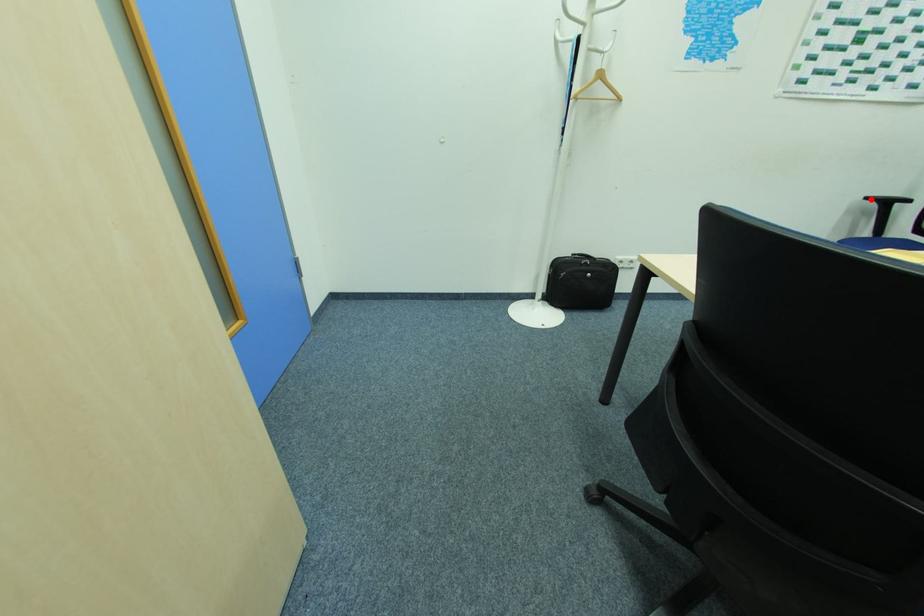
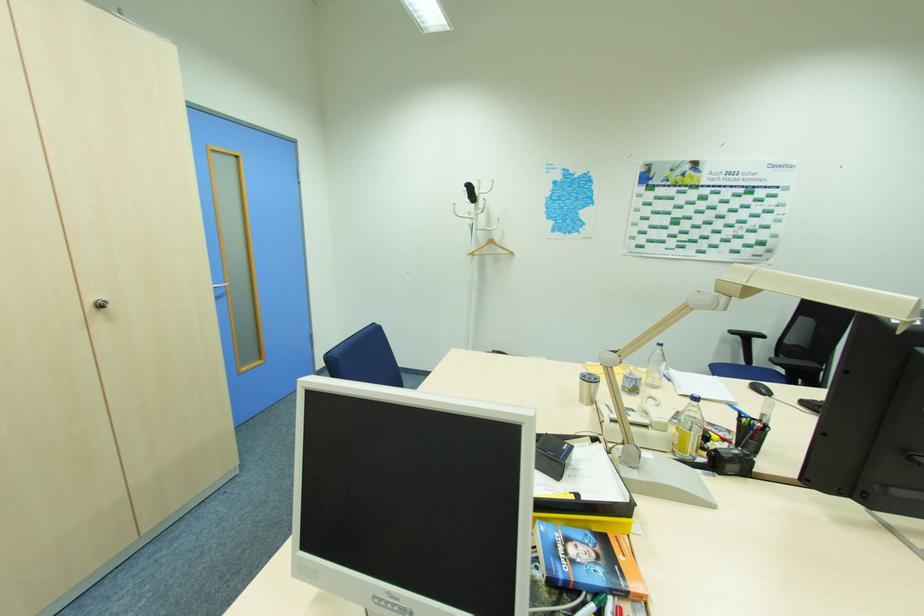
Question: I am providing you with two images of the same scene from different viewpoints. A red point is shown in image1. For the corresponding object point in image2, is it positioned nearer or farther from the camera?

Choices:
 (A) Nearer
 (B) Farther

Answer: (A)